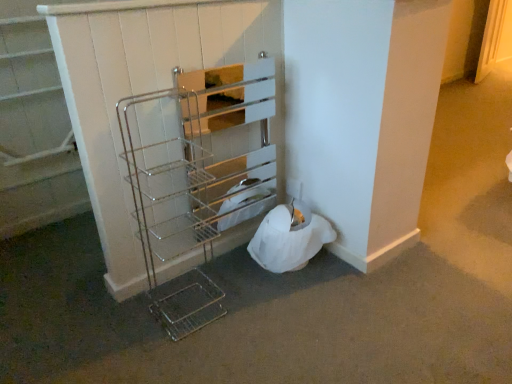
Question: Is chrome/metallic wire rack at center, which is counted as the 2th shelf, starting from the left, taller or shorter than metallic wire shelf at upper left, arranged as the 1th shelf when viewed from the left?

Choices:
 (A) short
 (B) tall

Answer: (B)

Question: Would you say chrome/metallic wire rack at center, which is counted as the 2th shelf, starting from the left, is to the left or to the right of metallic wire shelf at upper left, arranged as the 1th shelf when viewed from the left, in the picture?

Choices:
 (A) right
 (B) left

Answer: (A)

Question: Relative to metallic wire shelf at upper left, arranged as the 1th shelf when viewed from the left, is chrome/metallic wire rack at center, which is counted as the 2th shelf, starting from the left, in front or behind?

Choices:
 (A) front
 (B) behind

Answer: (A)

Question: Does point (45, 89) appear closer or farther from the camera than point (228, 188)?

Choices:
 (A) closer
 (B) farther

Answer: (A)

Question: Relative to chrome/metallic wire rack at center, which is counted as the 2th shelf, starting from the left, is metallic wire shelf at upper left, positioned as the second shelf in right-to-left order, in front or behind?

Choices:
 (A) front
 (B) behind

Answer: (B)

Question: Visually, is metallic wire shelf at upper left, positioned as the second shelf in right-to-left order, positioned to the left or to the right of chrome/metallic wire rack at center, which is the 1th shelf in right-to-left order?

Choices:
 (A) right
 (B) left

Answer: (B)

Question: Looking at the image, does metallic wire shelf at upper left, arranged as the 1th shelf when viewed from the left, seem bigger or smaller compared to chrome/metallic wire rack at center, which is the 1th shelf in right-to-left order?

Choices:
 (A) small
 (B) big

Answer: (A)